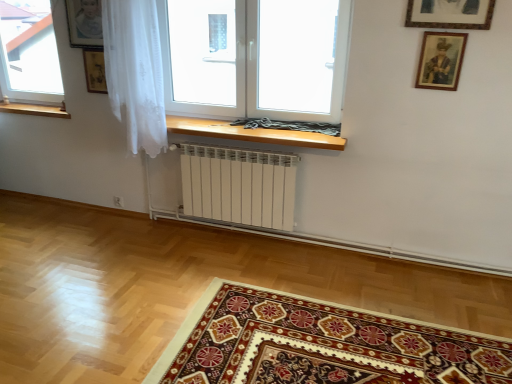
Question: Is the position of transparent glass window at center, the second window positioned from the left, more distant than that of transparent glass window at upper left, arranged as the second window when viewed from the right?

Choices:
 (A) yes
 (B) no

Answer: (B)

Question: Considering the relative sizes of transparent glass window at center, the second window positioned from the left, and transparent glass window at upper left, the 1th window from the left, in the image provided, is transparent glass window at center, the second window positioned from the left, taller than transparent glass window at upper left, the 1th window from the left,?

Choices:
 (A) no
 (B) yes

Answer: (A)

Question: Is transparent glass window at center, the first window positioned from the right, bigger than transparent glass window at upper left, arranged as the second window when viewed from the right?

Choices:
 (A) no
 (B) yes

Answer: (B)

Question: Is transparent glass window at center, the second window positioned from the left, closer to camera compared to transparent glass window at upper left, the 1th window from the left?

Choices:
 (A) yes
 (B) no

Answer: (A)

Question: Could you tell me if transparent glass window at center, the first window positioned from the right, is turned towards transparent glass window at upper left, arranged as the second window when viewed from the right?

Choices:
 (A) yes
 (B) no

Answer: (B)

Question: In the image, is carpet with intricate patterns at lower center positioned in front of or behind transparent glass window at center, the second window positioned from the left?

Choices:
 (A) behind
 (B) front

Answer: (B)

Question: Is point (202, 342) closer or farther from the camera than point (271, 29)?

Choices:
 (A) closer
 (B) farther

Answer: (A)

Question: Considering the positions of carpet with intricate patterns at lower center and transparent glass window at center, the first window positioned from the right, in the image, is carpet with intricate patterns at lower center bigger or smaller than transparent glass window at center, the first window positioned from the right,?

Choices:
 (A) small
 (B) big

Answer: (A)

Question: Is carpet with intricate patterns at lower center wider or thinner than transparent glass window at center, the first window positioned from the right?

Choices:
 (A) thin
 (B) wide

Answer: (B)

Question: Is transparent glass window at center, the first window positioned from the right, inside or outside of transparent glass window at upper left, the 1th window from the left?

Choices:
 (A) inside
 (B) outside

Answer: (B)

Question: Is transparent glass window at center, the second window positioned from the left, wider or thinner than transparent glass window at upper left, the 1th window from the left?

Choices:
 (A) wide
 (B) thin

Answer: (B)

Question: From the image's perspective, is transparent glass window at center, the second window positioned from the left, positioned above or below transparent glass window at upper left, arranged as the second window when viewed from the right?

Choices:
 (A) above
 (B) below

Answer: (B)

Question: In the image, is transparent glass window at center, the first window positioned from the right, positioned in front of or behind transparent glass window at upper left, the 1th window from the left?

Choices:
 (A) front
 (B) behind

Answer: (A)

Question: Is point [45, 92] positioned closer to the camera than point [401, 347]?

Choices:
 (A) closer
 (B) farther

Answer: (B)

Question: From the image's perspective, is transparent glass window at upper left, arranged as the second window when viewed from the right, above or below carpet with intricate patterns at lower center?

Choices:
 (A) below
 (B) above

Answer: (B)